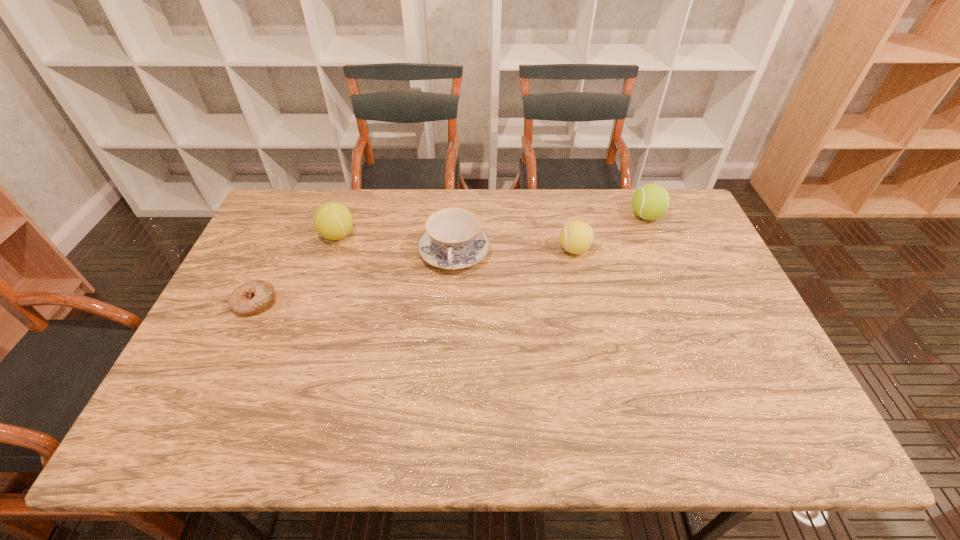
Locate an element on the screen. vacant area located on the front of the doughnut is located at coordinates (222, 374).

Locate an element on the screen. This screenshot has width=960, height=540. chinaware that is at the far edge is located at coordinates (453, 239).

Where is `object present at the left edge`? Image resolution: width=960 pixels, height=540 pixels. object present at the left edge is located at coordinates click(256, 296).

In order to click on object that is positioned at the right edge in this screenshot , I will do `click(651, 201)`.

Identify the location of object present at the far right corner. The width and height of the screenshot is (960, 540). (651, 201).

Image resolution: width=960 pixels, height=540 pixels. I want to click on free region at the far edge of the desktop, so click(x=398, y=210).

The height and width of the screenshot is (540, 960). I want to click on vacant space at the left edge, so click(260, 276).

The image size is (960, 540). In order to click on vacant space at the right edge of the desktop in this screenshot , I will do `click(691, 245)`.

In the image, there is a desktop. Identify the location of vacant space at the far right corner. (684, 201).

Locate an element on the screen. free space between the chinaware and the fourth object from right to left is located at coordinates (396, 244).